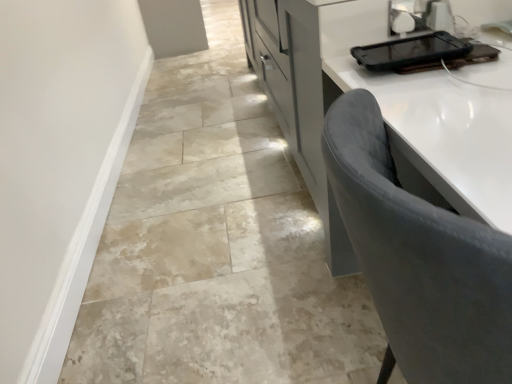
At what (x,y) coordinates should I click in order to perform the action: click on suede-like gray chair at right. Please return your answer as a coordinate pair (x, y). This screenshot has width=512, height=384. Looking at the image, I should click on (419, 259).

Measure the distance between suede-like gray chair at right and camera.

suede-like gray chair at right is 30.54 centimeters from camera.

This screenshot has width=512, height=384. What do you see at coordinates (419, 259) in the screenshot? I see `suede-like gray chair at right` at bounding box center [419, 259].

Identify the location of suede-like gray chair at right. (419, 259).